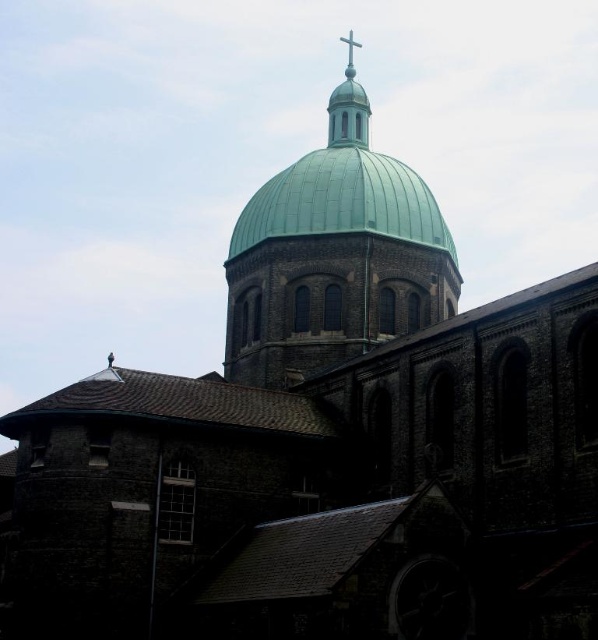
Question: Among these objects, which one is farthest from the camera?

Choices:
 (A) metallic cross at upper center
 (B) green dome at center

Answer: (A)

Question: Considering the relative positions of green dome at center and metallic cross at upper center in the image provided, where is green dome at center located with respect to metallic cross at upper center?

Choices:
 (A) left
 (B) right

Answer: (A)

Question: Does green dome at center have a larger size compared to metallic cross at upper center?

Choices:
 (A) yes
 (B) no

Answer: (B)

Question: Among these points, which one is nearest to the camera?

Choices:
 (A) (350, 54)
 (B) (251, 316)

Answer: (B)

Question: Can you confirm if green dome at center is positioned to the right of metallic cross at upper center?

Choices:
 (A) no
 (B) yes

Answer: (A)